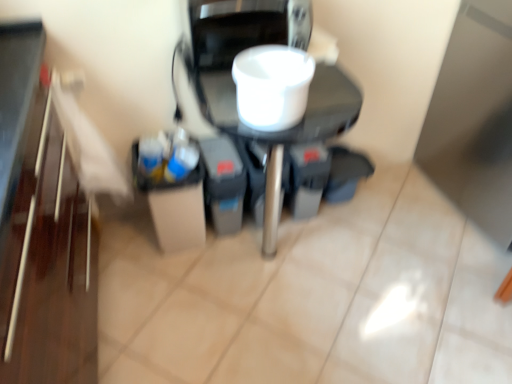
Where is `white matte cup at center, the first appliance viewed from the front`? white matte cup at center, the first appliance viewed from the front is located at coordinates [272, 86].

Measure the distance between point (257, 55) and camera.

The depth of point (257, 55) is 4.00 feet.

What do you see at coordinates (272, 86) in the screenshot? I see `white matte cup at center, positioned as the 2th appliance in back-to-front order` at bounding box center [272, 86].

Find the location of `white glossy coffee maker at center, which is counted as the 2th appliance, starting from the front`. white glossy coffee maker at center, which is counted as the 2th appliance, starting from the front is located at coordinates (269, 97).

How much space does white glossy coffee maker at center, which is counted as the 2th appliance, starting from the front, occupy vertically?

29.83 inches.

Image resolution: width=512 pixels, height=384 pixels. What do you see at coordinates (269, 97) in the screenshot?
I see `white glossy coffee maker at center, which is the 1th appliance from back to front` at bounding box center [269, 97].

Measure the distance between white glossy coffee maker at center, which is the 1th appliance from back to front, and camera.

3.42 feet.

Locate an element on the screen. The width and height of the screenshot is (512, 384). white matte cup at center, the first appliance viewed from the front is located at coordinates (272, 86).

Can you confirm if white matte cup at center, positioned as the 2th appliance in back-to-front order, is positioned to the left of white glossy coffee maker at center, which is the 1th appliance from back to front?

No.

Is white matte cup at center, positioned as the 2th appliance in back-to-front order, positioned in front of white glossy coffee maker at center, which is counted as the 2th appliance, starting from the front?

Yes, white matte cup at center, positioned as the 2th appliance in back-to-front order, is in front of white glossy coffee maker at center, which is counted as the 2th appliance, starting from the front.

Does point (284, 86) lie in front of point (201, 31)?

Yes, it is in front of point (201, 31).

From the image's perspective, would you say white matte cup at center, the first appliance viewed from the front, is positioned over white glossy coffee maker at center, which is the 1th appliance from back to front?

Indeed, from the image's perspective, white matte cup at center, the first appliance viewed from the front, is shown above white glossy coffee maker at center, which is the 1th appliance from back to front.

From a real-world perspective, is white matte cup at center, positioned as the 2th appliance in back-to-front order, beneath white glossy coffee maker at center, which is the 1th appliance from back to front?

No, from a real-world perspective, white matte cup at center, positioned as the 2th appliance in back-to-front order, is not beneath white glossy coffee maker at center, which is the 1th appliance from back to front.

In terms of width, does white matte cup at center, positioned as the 2th appliance in back-to-front order, look wider or thinner when compared to white glossy coffee maker at center, which is the 1th appliance from back to front?

Clearly, white matte cup at center, positioned as the 2th appliance in back-to-front order, has less width compared to white glossy coffee maker at center, which is the 1th appliance from back to front.

From their relative heights in the image, would you say white matte cup at center, the first appliance viewed from the front, is taller or shorter than white glossy coffee maker at center, which is counted as the 2th appliance, starting from the front?

In the image, white matte cup at center, the first appliance viewed from the front, appears to be shorter than white glossy coffee maker at center, which is counted as the 2th appliance, starting from the front.

Is white matte cup at center, the first appliance viewed from the front, bigger or smaller than white glossy coffee maker at center, which is the 1th appliance from back to front?

Clearly, white matte cup at center, the first appliance viewed from the front, is smaller in size than white glossy coffee maker at center, which is the 1th appliance from back to front.

Is white matte cup at center, the first appliance viewed from the front, spatially inside white glossy coffee maker at center, which is the 1th appliance from back to front, or outside of it?

white matte cup at center, the first appliance viewed from the front, is spatially situated outside white glossy coffee maker at center, which is the 1th appliance from back to front.

Is white matte cup at center, positioned as the 2th appliance in back-to-front order, placed right next to white glossy coffee maker at center, which is counted as the 2th appliance, starting from the front?

Yes.

Is white matte cup at center, the first appliance viewed from the front, oriented towards white glossy coffee maker at center, which is counted as the 2th appliance, starting from the front?

No, white matte cup at center, the first appliance viewed from the front, is not facing towards white glossy coffee maker at center, which is counted as the 2th appliance, starting from the front.

You are a GUI agent. You are given a task and a screenshot of the screen. Output one action in this format:
    pyautogui.click(x=<x>, y=<y>)
    Task: Click on the appliance lying above the white glossy coffee maker at center, which is counted as the 2th appliance, starting from the front (from the image's perspective)
    
    Given the screenshot: What is the action you would take?
    pyautogui.click(x=272, y=86)

Does white glossy coffee maker at center, which is the 1th appliance from back to front, appear on the right side of white matte cup at center, the first appliance viewed from the front?

No, white glossy coffee maker at center, which is the 1th appliance from back to front, is not to the right of white matte cup at center, the first appliance viewed from the front.

Is white glossy coffee maker at center, which is the 1th appliance from back to front, positioned before white matte cup at center, positioned as the 2th appliance in back-to-front order?

No, the depth of white glossy coffee maker at center, which is the 1th appliance from back to front, is greater than that of white matte cup at center, positioned as the 2th appliance in back-to-front order.

Which point is more distant from viewer, (202, 47) or (273, 68)?

The point (202, 47) is behind.

From the image's perspective, between white glossy coffee maker at center, which is the 1th appliance from back to front, and white matte cup at center, positioned as the 2th appliance in back-to-front order, which one is located above?

white matte cup at center, positioned as the 2th appliance in back-to-front order, appears higher in the image.

From a real-world perspective, is white glossy coffee maker at center, which is the 1th appliance from back to front, located beneath white matte cup at center, positioned as the 2th appliance in back-to-front order?

Indeed, from a real-world perspective, white glossy coffee maker at center, which is the 1th appliance from back to front, is positioned beneath white matte cup at center, positioned as the 2th appliance in back-to-front order.

Is white glossy coffee maker at center, which is the 1th appliance from back to front, wider than white matte cup at center, positioned as the 2th appliance in back-to-front order?

Yes.

Based on the photo, from their relative heights in the image, would you say white glossy coffee maker at center, which is counted as the 2th appliance, starting from the front, is taller or shorter than white matte cup at center, the first appliance viewed from the front?

In the image, white glossy coffee maker at center, which is counted as the 2th appliance, starting from the front, appears to be taller than white matte cup at center, the first appliance viewed from the front.

Does white glossy coffee maker at center, which is the 1th appliance from back to front, have a larger size compared to white matte cup at center, positioned as the 2th appliance in back-to-front order?

Indeed, white glossy coffee maker at center, which is the 1th appliance from back to front, has a larger size compared to white matte cup at center, positioned as the 2th appliance in back-to-front order.

Would you say white matte cup at center, the first appliance viewed from the front, is part of white glossy coffee maker at center, which is counted as the 2th appliance, starting from the front,'s contents?

No, white glossy coffee maker at center, which is counted as the 2th appliance, starting from the front, does not contain white matte cup at center, the first appliance viewed from the front.

Are white glossy coffee maker at center, which is counted as the 2th appliance, starting from the front, and white matte cup at center, the first appliance viewed from the front, beside each other?

Yes, white glossy coffee maker at center, which is counted as the 2th appliance, starting from the front, is in contact with white matte cup at center, the first appliance viewed from the front.

Is white glossy coffee maker at center, which is counted as the 2th appliance, starting from the front, positioned with its back to white matte cup at center, positioned as the 2th appliance in back-to-front order?

That's not correct — white glossy coffee maker at center, which is counted as the 2th appliance, starting from the front, is not looking away from white matte cup at center, positioned as the 2th appliance in back-to-front order.

How different are the orientations of white glossy coffee maker at center, which is counted as the 2th appliance, starting from the front, and white matte cup at center, the first appliance viewed from the front, in degrees?

There is a 2.38-degree angle between the facing directions of white glossy coffee maker at center, which is counted as the 2th appliance, starting from the front, and white matte cup at center, the first appliance viewed from the front.

I want to click on appliance on the right of white glossy coffee maker at center, which is counted as the 2th appliance, starting from the front, so click(272, 86).

This screenshot has width=512, height=384. Identify the location of appliance below the white matte cup at center, the first appliance viewed from the front (from a real-world perspective). (269, 97).

At what (x,y) coordinates should I click in order to perform the action: click on appliance below the white matte cup at center, the first appliance viewed from the front (from the image's perspective). Please return your answer as a coordinate pair (x, y). This screenshot has width=512, height=384. Looking at the image, I should click on (269, 97).